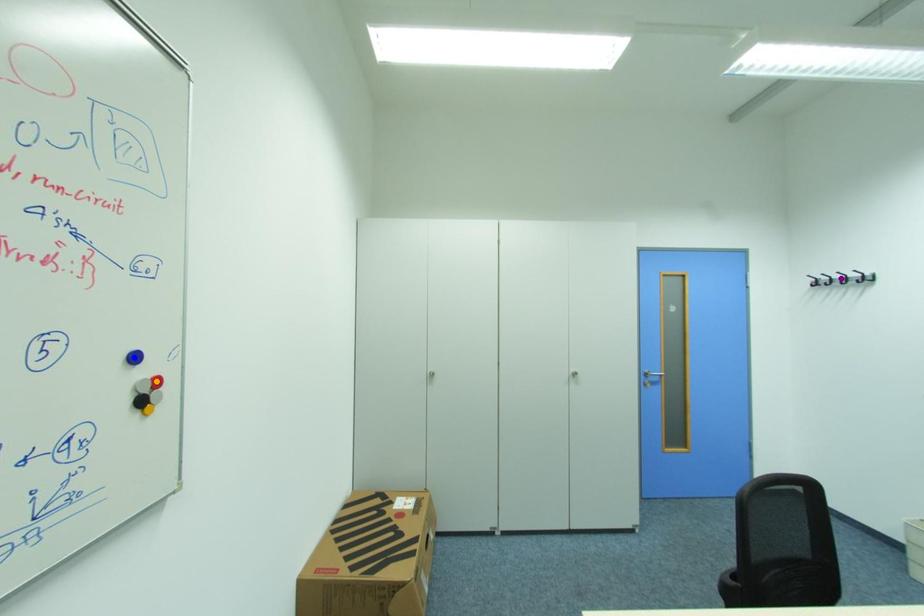
Order these from nearest to farthest:
1. orange point
2. purple point
3. blue point

1. blue point
2. orange point
3. purple point